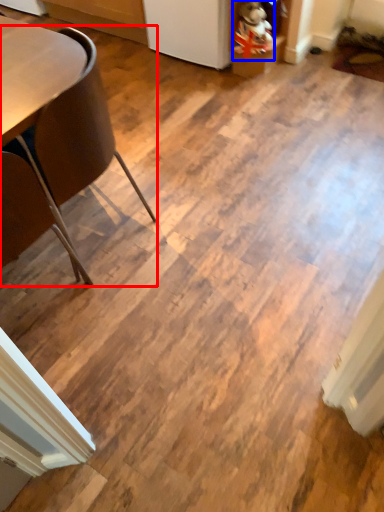
Question: Among these objects, which one is farthest to the camera, chair (highlighted by a red box) or toy (highlighted by a blue box)?

Choices:
 (A) chair
 (B) toy

Answer: (B)